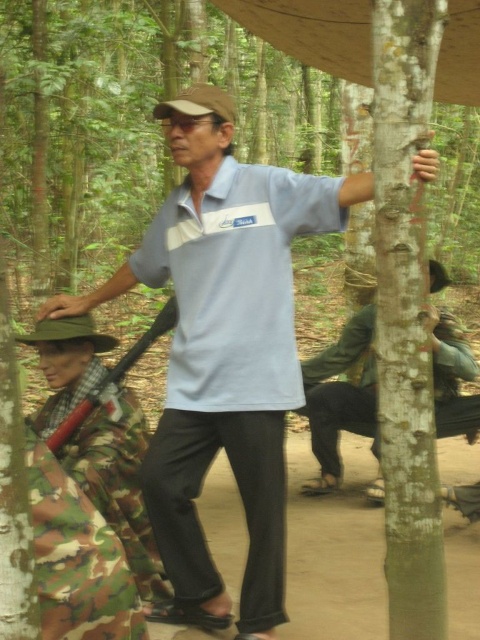
You are a hiker trying to navigate through the forest. You see a smooth bark tree at right at point (x=406, y=316). Can you confirm if this point is located to the right side of the image?

Yes, the smooth bark tree at right at point (x=406, y=316) is indeed located on the right side of the image.

In the forest scene, there are two people wearing light blue tops. One is wearing a light blue cotton shirt at center and the other a light blue fabric polo shirt at center. Which of these two tops is taller?

The light blue cotton shirt at center is taller than the light blue fabric polo shirt at center.

You are a photographer trying to capture a clear shot of both the light blue cotton shirt at center and the light blue fabric polo shirt at center in the forest scene. Which one should you focus on first to ensure it appears sharp in your photo?

You should focus on the light blue cotton shirt at center first because it is closer to the viewer than the light blue fabric polo shirt at center, ensuring it stays sharp while the background might blur slightly.